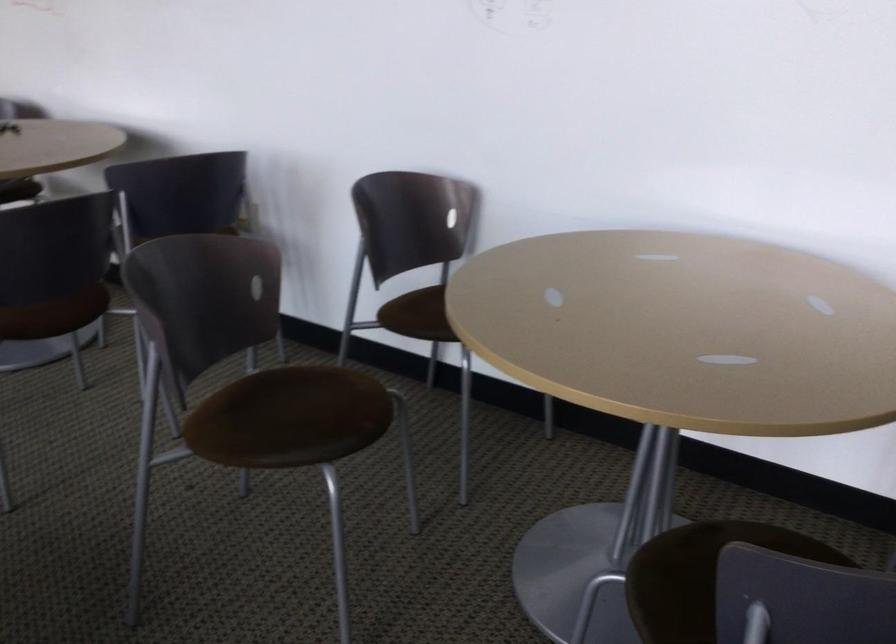
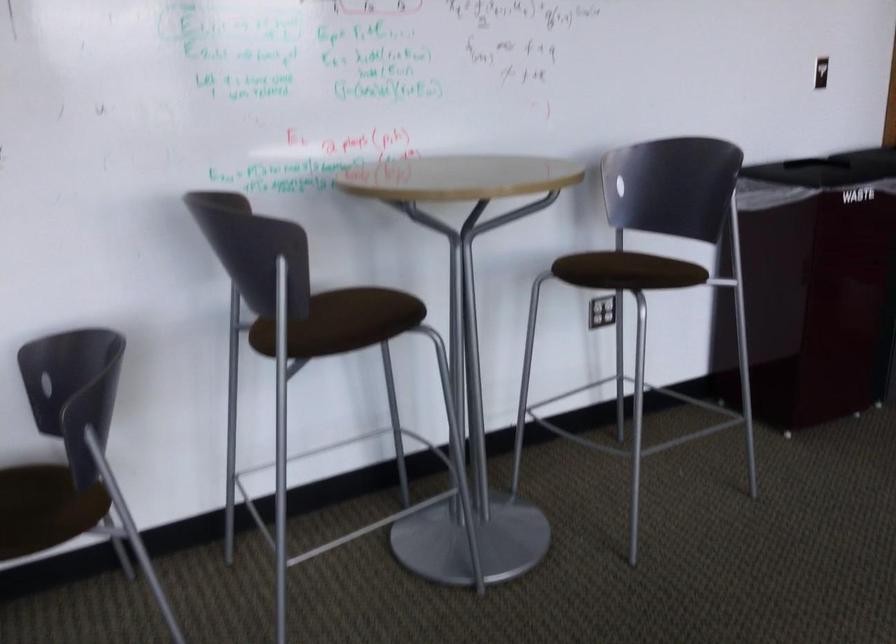
Question: The camera is either moving clockwise (left) or counter-clockwise (right) around the object. The first image is from the beginning of the video and the second image is from the end. Is the camera moving left or right when shooting the video?

Choices:
 (A) Left
 (B) Right

Answer: (A)